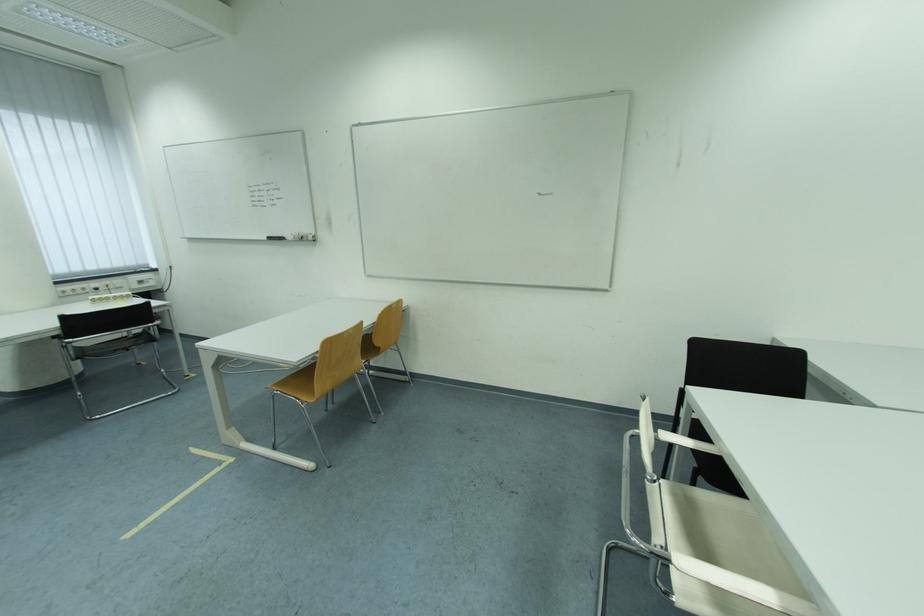
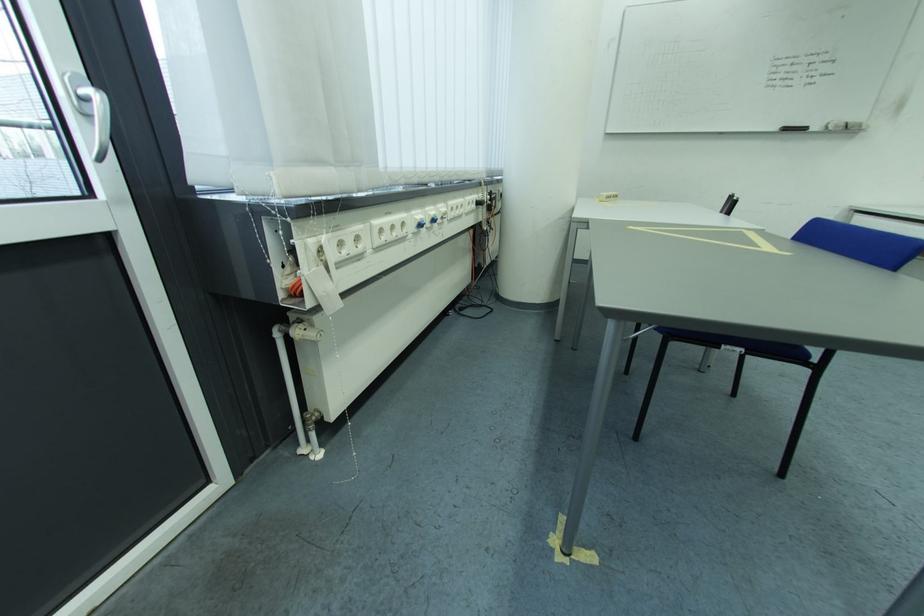
Find the pixel in the second image that matches (x=280, y=241) in the first image.

(796, 131)